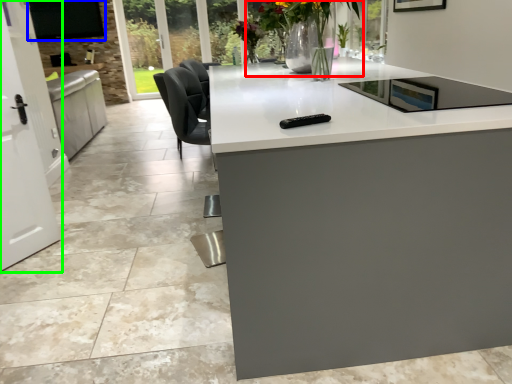
Question: Which object is positioned closest to floral arrangement (highlighted by a red box)? Select from window screen (highlighted by a blue box) and screen door (highlighted by a green box).

Choices:
 (A) window screen
 (B) screen door

Answer: (B)